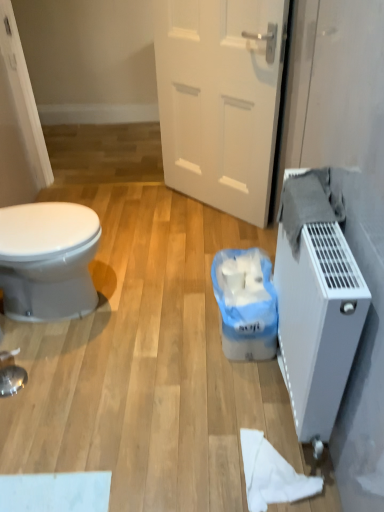
Where is `free spot in front of white plastic bag at lower center`? free spot in front of white plastic bag at lower center is located at coordinates (223, 391).